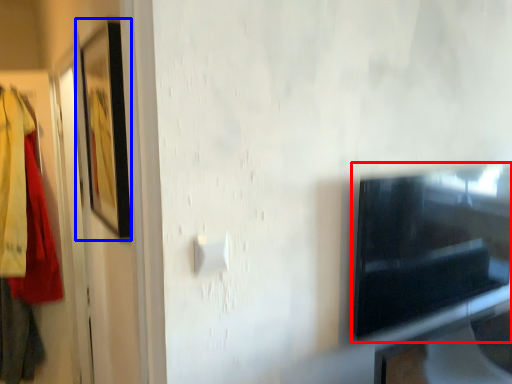
Question: Which point is further to the camera, appliance (highlighted by a red box) or picture frame (highlighted by a blue box)?

Choices:
 (A) appliance
 (B) picture frame

Answer: (A)